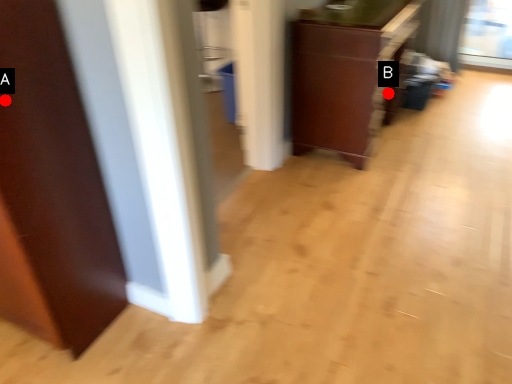
Question: Two points are circled on the image, labeled by A and B beside each circle. Which point is closer to the camera?

Choices:
 (A) A is closer
 (B) B is closer

Answer: (A)